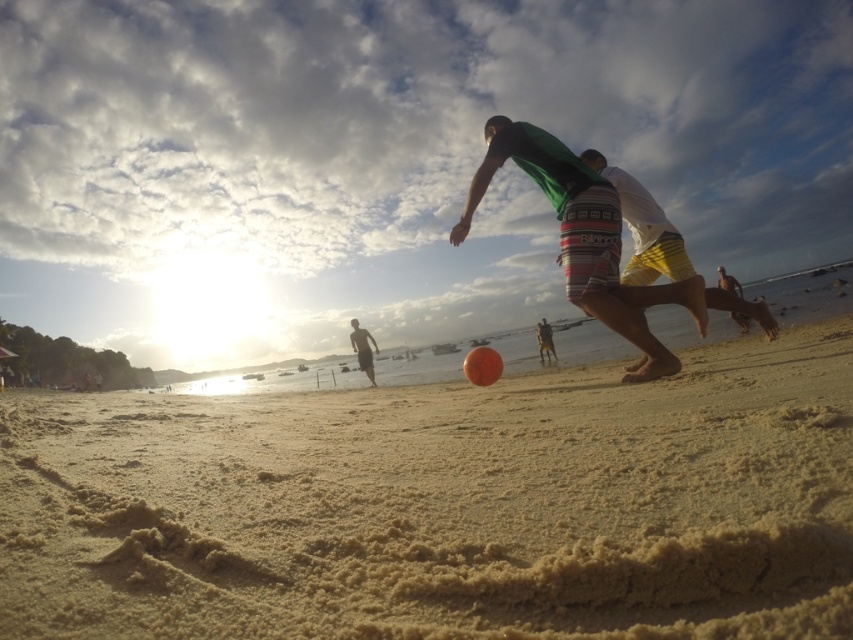
Question: Where is green striped shorts at center located in relation to green fabric shirt at center in the image?

Choices:
 (A) right
 (B) left

Answer: (B)

Question: Based on their relative distances, which object is farther from the smooth skin person at center?

Choices:
 (A) green striped shorts at center
 (B) green fabric shirt at center
 (C) sandy yellow at center

Answer: (A)

Question: From the image, what is the correct spatial relationship of sandy yellow at center in relation to smooth skin person at center?

Choices:
 (A) above
 (B) below

Answer: (B)

Question: Is the position of green striped shorts at center less distant than that of green fabric shirt at center?

Choices:
 (A) no
 (B) yes

Answer: (B)

Question: Which object is positioned closest to the smooth skin person at center?

Choices:
 (A) sandy yellow at center
 (B) green striped shorts at center
 (C) green fabric shirt at center

Answer: (C)

Question: Which of the following is the closest to the observer?

Choices:
 (A) (527, 124)
 (B) (364, 360)
 (C) (692, 422)

Answer: (C)